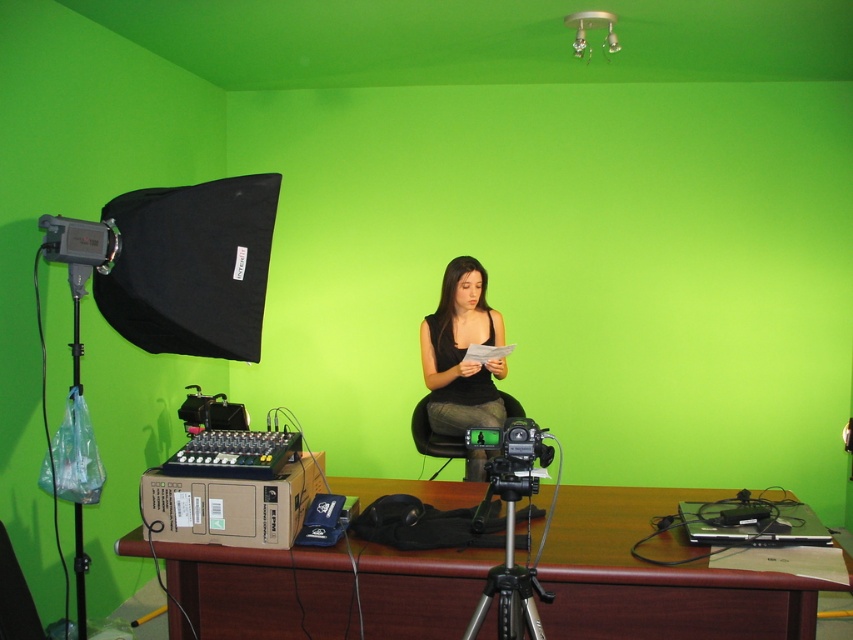
You are setting up a video shoot and need to place a large camera on the desk. Given the brown wooden table at center and the silver metallic tripod at center, which object can accommodate the camera better based on size?

The brown wooden table at center is bigger than the silver metallic tripod at center, so it can accommodate the camera better.

You are a costume designer preparing for a photoshoot. You have a black matte dress at center and a silver metallic tripod at center in the scene. Which item is wider?

The black matte dress at center is wider than the silver metallic tripod at center.